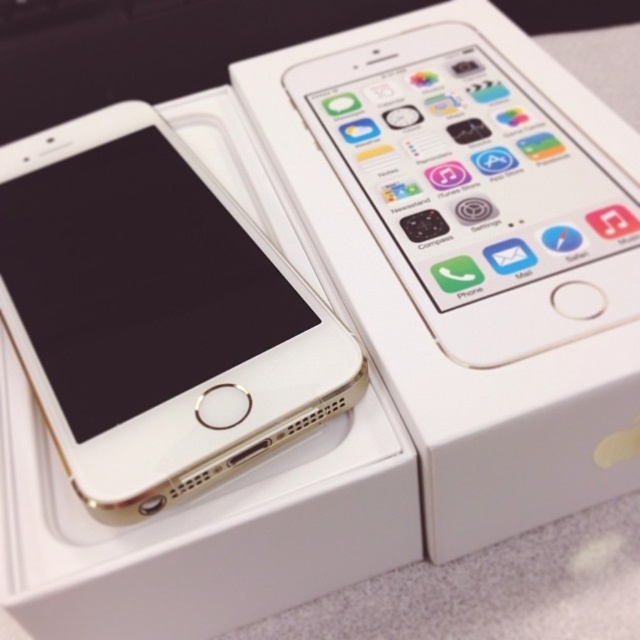
Question: Is gold matte smartphone at upper left positioned behind gold metallic smartphone at upper center?

Choices:
 (A) no
 (B) yes

Answer: (A)

Question: Which point is closer to the camera taking this photo?

Choices:
 (A) (582, 212)
 (B) (154, 397)

Answer: (B)

Question: Is gold matte smartphone at upper left behind gold metallic smartphone at upper center?

Choices:
 (A) yes
 (B) no

Answer: (B)

Question: Which of the following is the closest to the observer?

Choices:
 (A) gold matte smartphone at upper left
 (B) gold metallic smartphone at upper center

Answer: (A)

Question: Can you confirm if gold matte smartphone at upper left is positioned to the right of gold metallic smartphone at upper center?

Choices:
 (A) no
 (B) yes

Answer: (A)